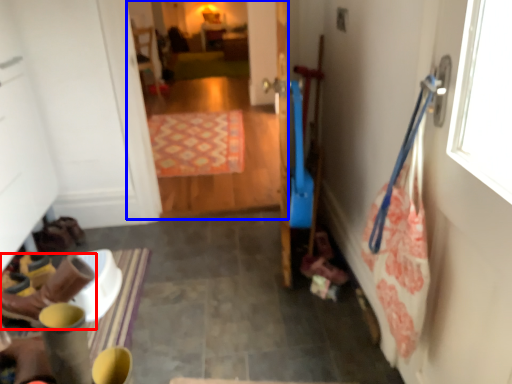
Question: Which object is closer to the camera taking this photo, footwear (highlighted by a red box) or corridor (highlighted by a blue box)?

Choices:
 (A) footwear
 (B) corridor

Answer: (A)